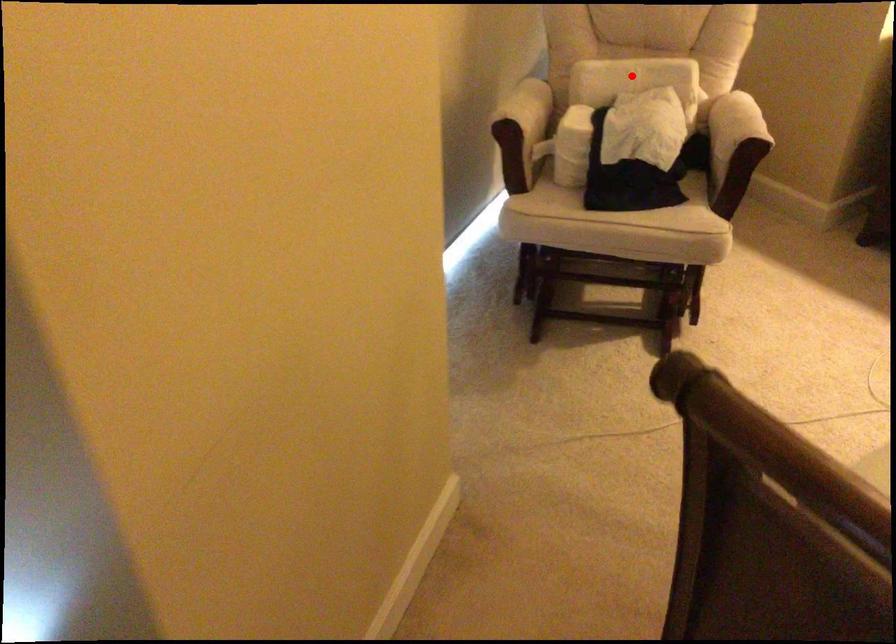
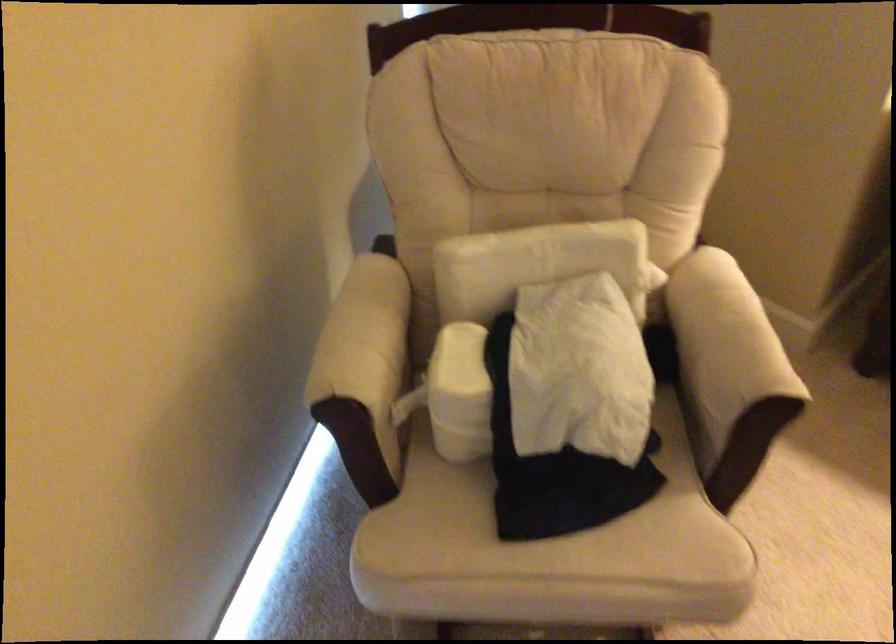
Question: A red point is marked in image1. In image2, is the corresponding 3D point closer to the camera or farther? Reply with the corresponding letter.

Choices:
 (A) The corresponding 3D point is closer.
 (B) The corresponding 3D point is farther.

Answer: (A)